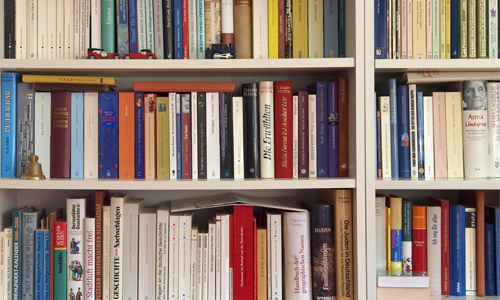
Find the location of a particular element. purple books is located at coordinates (111, 147), (137, 145), (319, 148), (330, 148).